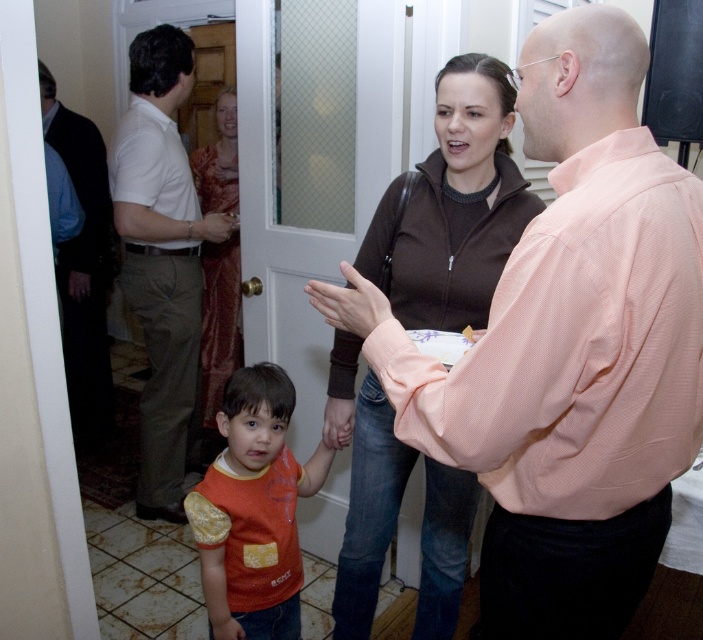
Question: Which is farther from the brown zip-up jacket at center?

Choices:
 (A) white cotton shirt at left
 (B) smooth skin hand at center
 (C) matte orange shirt at lower left
 (D) dark blue shirt at left

Answer: (D)

Question: Is silky red sari at door positioned at the back of smooth skin hand at center?

Choices:
 (A) yes
 (B) no

Answer: (A)

Question: Which object is the farthest from the silky red sari at door?

Choices:
 (A) smooth skin hand at center
 (B) matte plastic door handle at center
 (C) matte orange shirt at lower left

Answer: (A)

Question: Based on their relative distances, which object is farther from the brown zip-up jacket at center?

Choices:
 (A) dark blue shirt at left
 (B) silky red sari at door
 (C) smooth skin hand at center

Answer: (A)

Question: Is smooth skin hand at center smaller than matte orange shirt at lower left?

Choices:
 (A) no
 (B) yes

Answer: (A)

Question: Does white cotton shirt at left have a larger size compared to matte orange shirt at lower left?

Choices:
 (A) yes
 (B) no

Answer: (A)